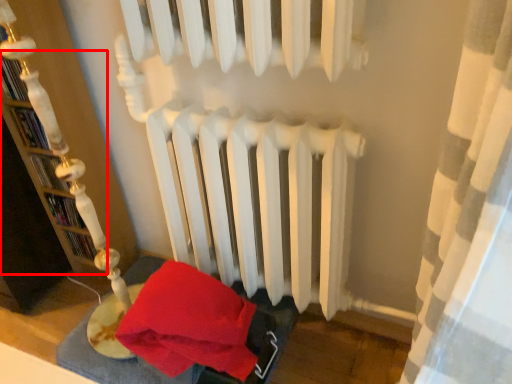
Question: From the image's perspective, what is the correct spatial positioning of bookshelf (annotated by the red box) in reference to bed frame?

Choices:
 (A) above
 (B) below

Answer: (A)